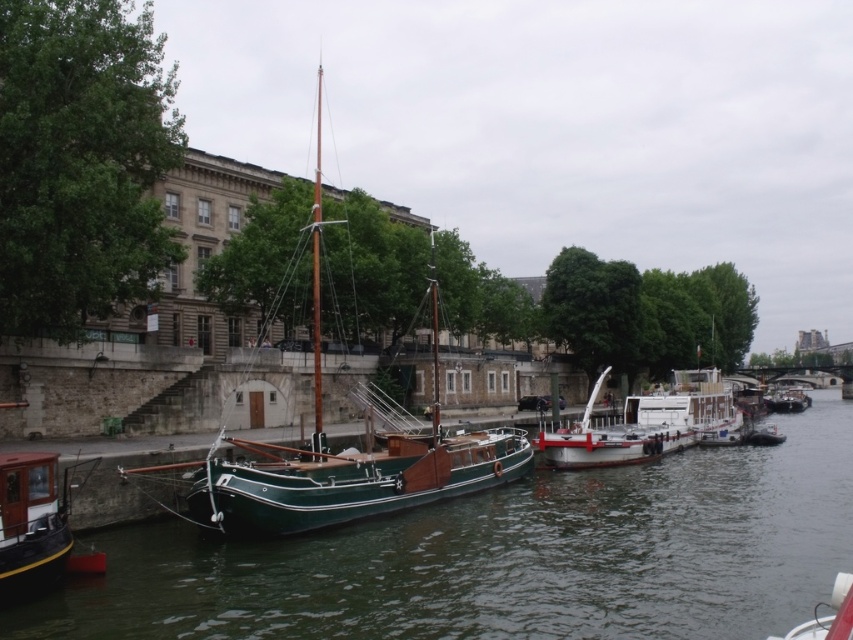
Does green polished wood sailboat at center have a larger size compared to white glossy boat at lower right?

Indeed, green polished wood sailboat at center has a larger size compared to white glossy boat at lower right.

The height and width of the screenshot is (640, 853). I want to click on green polished wood sailboat at center, so click(347, 452).

Can you confirm if green wooden boat at center is smaller than green polished wood sailboat at center?

Yes.

Can you confirm if green wooden boat at center is wider than green polished wood sailboat at center?

Correct, the width of green wooden boat at center exceeds that of green polished wood sailboat at center.

Between point (701, 460) and point (277, 529), which one is positioned in front?

Point (277, 529) is in front.

You are a GUI agent. You are given a task and a screenshot of the screen. Output one action in this format:
    pyautogui.click(x=<x>, y=<y>)
    Task: Click on the green wooden boat at center
    
    Given the screenshot: What is the action you would take?
    pyautogui.click(x=509, y=557)

Can you confirm if white matte boat at center is wider than green wooden boat at right?

No, white matte boat at center is not wider than green wooden boat at right.

Which of these two, white matte boat at center or green wooden boat at right, stands shorter?

green wooden boat at right

Where is `white matte boat at center`? white matte boat at center is located at coordinates (625, 432).

Image resolution: width=853 pixels, height=640 pixels. I want to click on white matte boat at center, so click(625, 432).